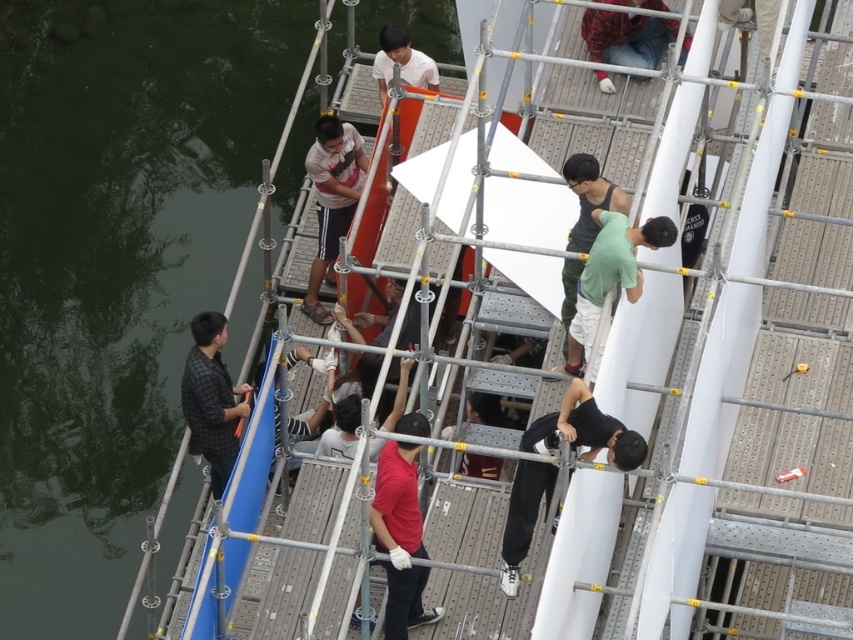
Is light gray fabric shirt at center bigger than light brown shirt at center?

Indeed, light gray fabric shirt at center has a larger size compared to light brown shirt at center.

Is point (331, 276) closer to camera compared to point (395, 60)?

No, (331, 276) is behind (395, 60).

Locate an element on the screen. This screenshot has width=853, height=640. light gray fabric shirt at center is located at coordinates (331, 198).

Between black matte pants at lower right and matte red shirt at center, which one is positioned lower?

matte red shirt at center is below.

Who is more distant from viewer, (576, 420) or (421, 552)?

The point (421, 552) is behind.

This screenshot has height=640, width=853. What do you see at coordinates (584, 429) in the screenshot? I see `black matte pants at lower right` at bounding box center [584, 429].

Where is `black matte pants at lower right`? This screenshot has height=640, width=853. black matte pants at lower right is located at coordinates (584, 429).

Which of these two, black matte pants at lower right or denim jeans at center, stands shorter?

denim jeans at center is shorter.

Which is in front, point (566, 401) or point (677, 26)?

Point (566, 401) is in front.

The image size is (853, 640). I want to click on black matte pants at lower right, so click(584, 429).